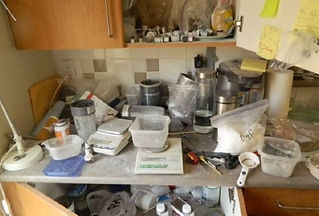
Generate point markers for all where you would plug in applicances in the image. Your answer should be formatted as a list of tuples, i.e. [(x1, y1), (x2, y2), ...], where each tuple contains the x and y coordinates of a point satisfying the conditions above.

[(69, 70)]